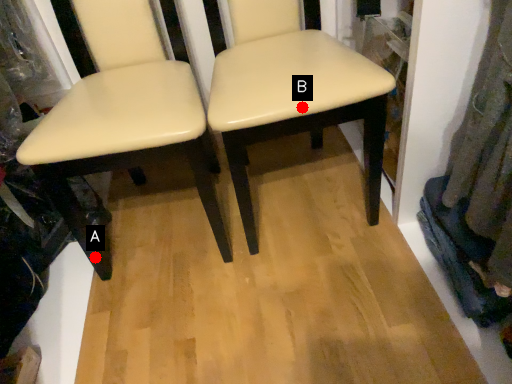
Question: Two points are circled on the image, labeled by A and B beside each circle. Which point appears closest to the camera in this image?

Choices:
 (A) A is closer
 (B) B is closer

Answer: (B)